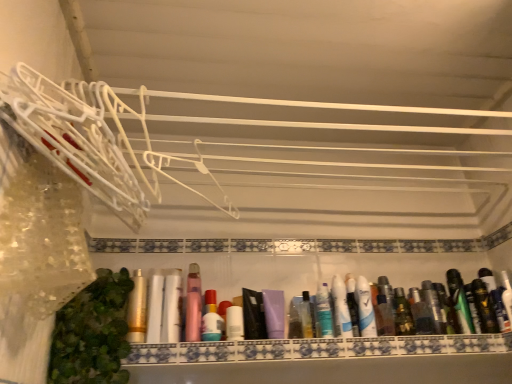
Question: Is matte purple tube at center, the seventeenth toiletry in the left-to-right sequence, not within matte gold tube at center, the second toiletry when ordered from left to right?

Choices:
 (A) yes
 (B) no

Answer: (A)

Question: From the image's perspective, is matte purple tube at center, the first toiletry from the right, on top of matte gold tube at center, the second toiletry when ordered from left to right?

Choices:
 (A) no
 (B) yes

Answer: (B)

Question: Can you confirm if matte purple tube at center, the first toiletry from the right, is smaller than matte gold tube at center, the second toiletry when ordered from left to right?

Choices:
 (A) no
 (B) yes

Answer: (B)

Question: Can you confirm if matte purple tube at center, the seventeenth toiletry in the left-to-right sequence, is thinner than matte gold tube at center, the second toiletry when ordered from left to right?

Choices:
 (A) no
 (B) yes

Answer: (B)

Question: Does matte purple tube at center, the seventeenth toiletry in the left-to-right sequence, come in front of matte gold tube at center, marked as the 16th toiletry in a right-to-left arrangement?

Choices:
 (A) yes
 (B) no

Answer: (B)

Question: From a real-world perspective, is matte purple tube at center, the first toiletry from the right, physically below matte gold tube at center, marked as the 16th toiletry in a right-to-left arrangement?

Choices:
 (A) yes
 (B) no

Answer: (A)

Question: Considering the relative sizes of matte black deodorant at center right, the 16th toiletry in the left-to-right sequence, and white matte lotion at center, placed as the eleventh toiletry when sorted from right to left, in the image provided, is matte black deodorant at center right, the 16th toiletry in the left-to-right sequence, thinner than white matte lotion at center, placed as the eleventh toiletry when sorted from right to left,?

Choices:
 (A) no
 (B) yes

Answer: (B)

Question: Is matte black deodorant at center right, the 16th toiletry in the left-to-right sequence, taller than white matte lotion at center, placed as the eleventh toiletry when sorted from right to left?

Choices:
 (A) yes
 (B) no

Answer: (A)

Question: Does matte black deodorant at center right, marked as the second toiletry in a right-to-left arrangement, appear on the left side of white matte lotion at center, which ranks as the seventh toiletry in left-to-right order?

Choices:
 (A) no
 (B) yes

Answer: (A)

Question: Considering the relative sizes of matte black deodorant at center right, the 16th toiletry in the left-to-right sequence, and white matte lotion at center, placed as the eleventh toiletry when sorted from right to left, in the image provided, is matte black deodorant at center right, the 16th toiletry in the left-to-right sequence, bigger than white matte lotion at center, placed as the eleventh toiletry when sorted from right to left,?

Choices:
 (A) no
 (B) yes

Answer: (A)

Question: Considering the relative sizes of matte black deodorant at center right, marked as the second toiletry in a right-to-left arrangement, and white matte lotion at center, which ranks as the seventh toiletry in left-to-right order, in the image provided, is matte black deodorant at center right, marked as the second toiletry in a right-to-left arrangement, smaller than white matte lotion at center, which ranks as the seventh toiletry in left-to-right order,?

Choices:
 (A) no
 (B) yes

Answer: (B)

Question: Is matte black deodorant at center right, the 16th toiletry in the left-to-right sequence, positioned behind white matte lotion at center, which ranks as the seventh toiletry in left-to-right order?

Choices:
 (A) yes
 (B) no

Answer: (A)

Question: Is matte plastic bottles at center positioned with its back to matte black deodorant at center right, the 16th toiletry in the left-to-right sequence?

Choices:
 (A) yes
 (B) no

Answer: (B)